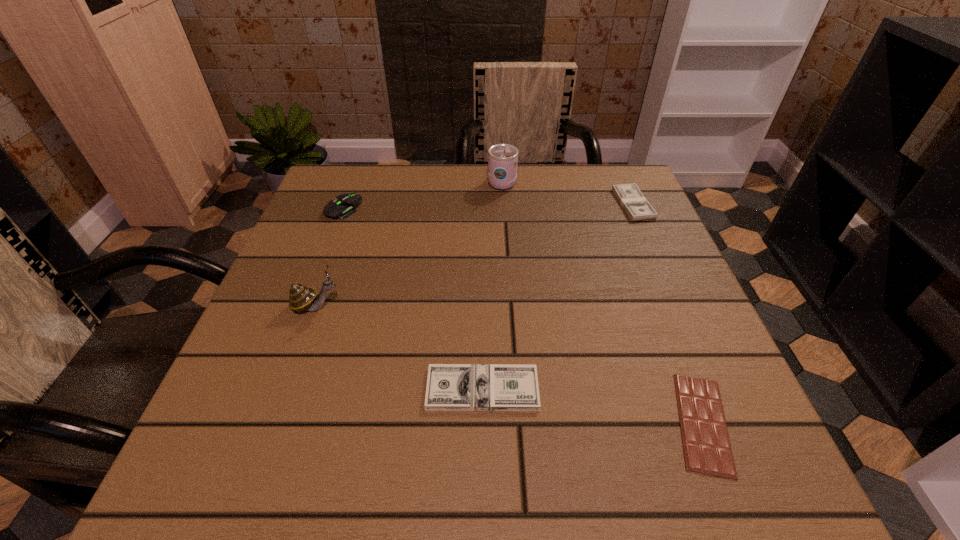
You are a GUI agent. You are given a task and a screenshot of the screen. Output one action in this format:
    pyautogui.click(x=<x>, y=<y>)
    Task: Click on the dollar that is at the right edge
    
    Given the screenshot: What is the action you would take?
    pyautogui.click(x=636, y=206)

Find the location of `chocolate bar that is at the right edge`. chocolate bar that is at the right edge is located at coordinates (707, 449).

Locate an element on the screen. object at the far left corner is located at coordinates (347, 203).

I want to click on object that is at the far right corner, so click(636, 206).

Locate an element on the screen. Image resolution: width=960 pixels, height=540 pixels. object present at the near right corner is located at coordinates (707, 449).

Find the location of a particular element. The height and width of the screenshot is (540, 960). vacant space at the far edge of the desktop is located at coordinates (406, 175).

Locate an element on the screen. vacant space at the near edge of the desktop is located at coordinates (314, 487).

In the image, there is a desktop. At what (x,y) coordinates should I click in order to perform the action: click on free region at the left edge. Please return your answer as a coordinate pair (x, y). This screenshot has height=540, width=960. Looking at the image, I should click on (327, 308).

I want to click on free space at the right edge, so click(636, 347).

In the image, there is a desktop. What are the coordinates of `vacant space at the near left corner` in the screenshot? It's located at (245, 495).